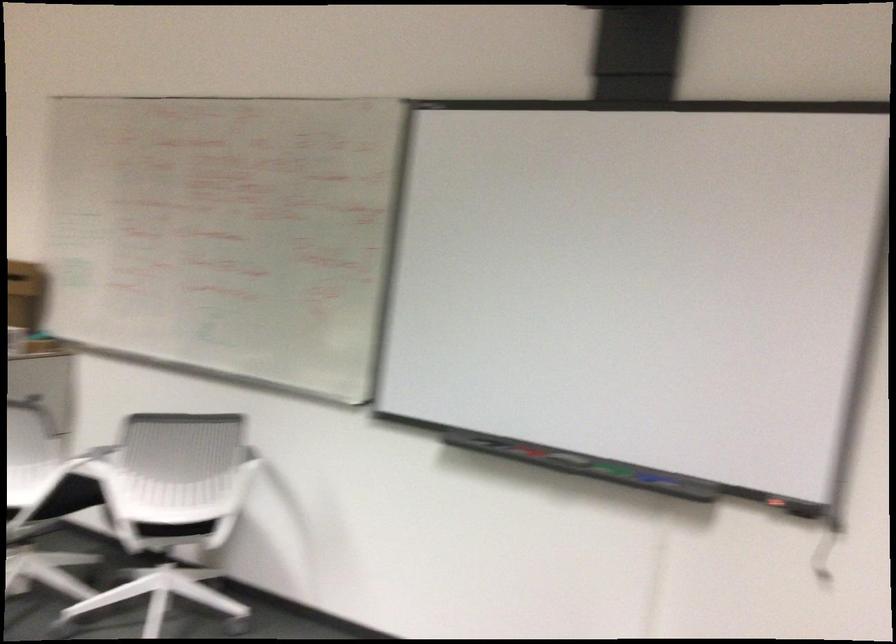
Identify the location of chair armrest. (95, 460).